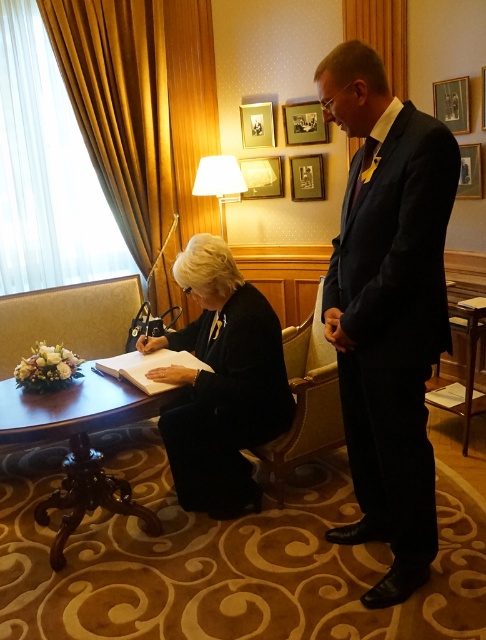
This screenshot has height=640, width=486. Describe the element at coordinates (387, 307) in the screenshot. I see `black suit at center` at that location.

Where is `black suit at center`? The height and width of the screenshot is (640, 486). black suit at center is located at coordinates (387, 307).

Find the location of a particular element. Image resolution: width=486 pixels, height=640 pixels. black suit at center is located at coordinates (387, 307).

In the scene shown: Is mahogany wood round table at lower left shorter than wooden table at lower right?

Indeed, mahogany wood round table at lower left has a lesser height compared to wooden table at lower right.

Can you confirm if mahogany wood round table at lower left is smaller than wooden table at lower right?

No, mahogany wood round table at lower left is not smaller than wooden table at lower right.

What do you see at coordinates (80, 444) in the screenshot? I see `mahogany wood round table at lower left` at bounding box center [80, 444].

The image size is (486, 640). Find the location of `mahogany wood round table at lower left`. mahogany wood round table at lower left is located at coordinates (80, 444).

Which is in front, point (389, 474) or point (455, 392)?

Point (389, 474)

Is navy blue suit at center taller than wooden table at lower right?

Yes.

The width and height of the screenshot is (486, 640). I want to click on navy blue suit at center, so click(x=394, y=321).